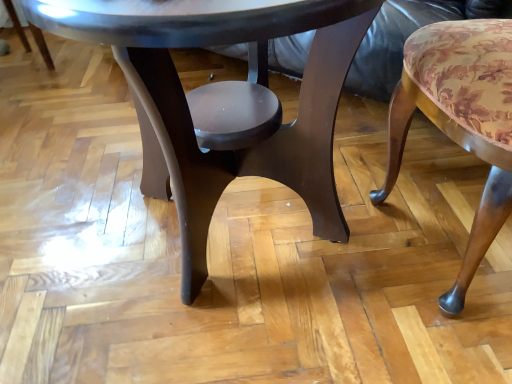
This screenshot has height=384, width=512. I want to click on vacant region below glossy dark wood coffee table at center (from a real-world perspective), so 230,232.